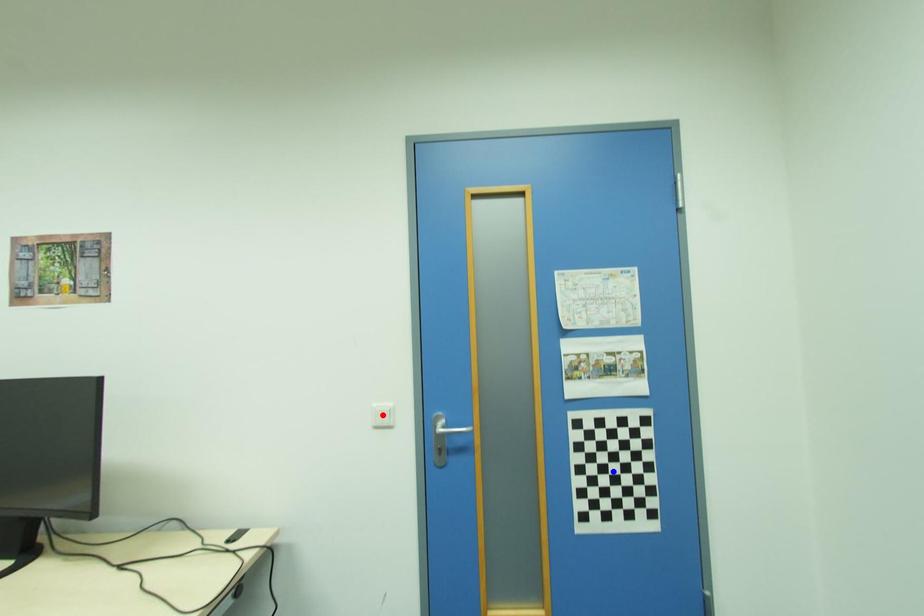
Question: Two points are marked on the image. Which point is closer to the camera?

Choices:
 (A) Blue point is closer.
 (B) Red point is closer.

Answer: (A)